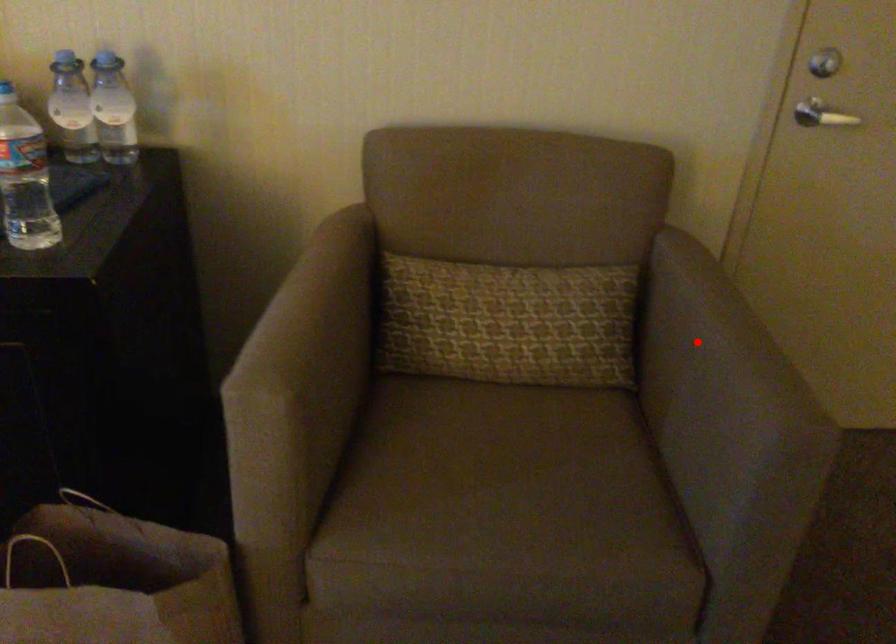
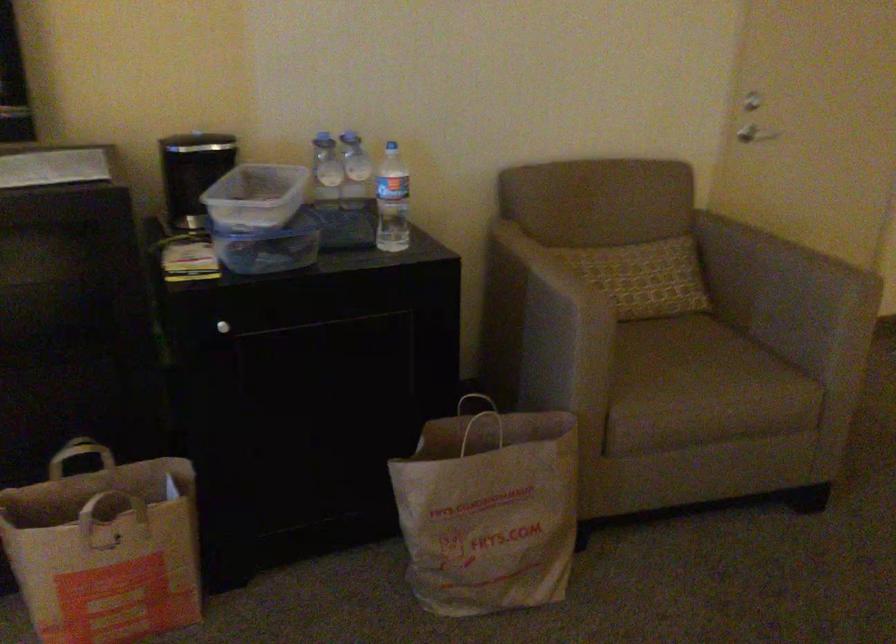
Question: I am providing you with two images of the same scene from different viewpoints. A red point is marked on the first image. At the location where the point appears in image 1, is it still visible in image 2?

Choices:
 (A) Yes
 (B) No

Answer: (A)